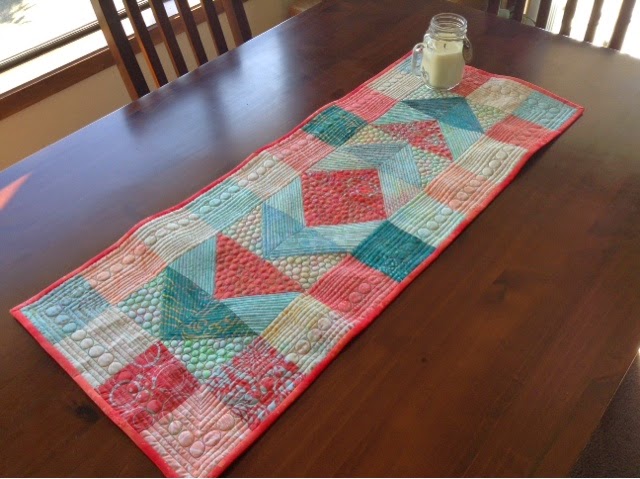
You are a GUI agent. You are given a task and a screenshot of the screen. Output one action in this format:
    pyautogui.click(x=<x>, y=<y>)
    Task: Click on the table
    This screenshot has height=479, width=640.
    Given the screenshot: What is the action you would take?
    pyautogui.click(x=518, y=378)